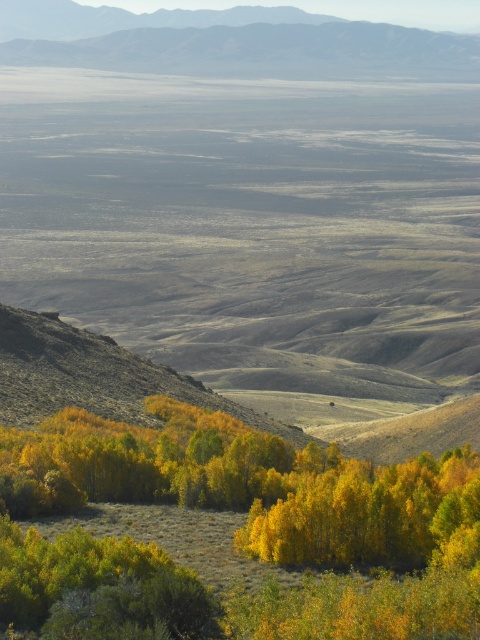
Question: Which object appears closest to the camera in this image?

Choices:
 (A) rugged brown mountain at upper center
 (B) yellow leafy trees at lower left

Answer: (B)

Question: Is yellow leafy trees at lower left positioned in front of rugged brown mountain at upper center?

Choices:
 (A) no
 (B) yes

Answer: (B)

Question: Which point is farther from the camera taking this photo?

Choices:
 (A) (324, 540)
 (B) (40, 10)

Answer: (B)

Question: Can you confirm if yellow leafy trees at lower left is wider than rugged brown mountain at upper center?

Choices:
 (A) no
 (B) yes

Answer: (A)

Question: Which point is closer to the camera taking this photo?

Choices:
 (A) (479, 531)
 (B) (86, 58)

Answer: (A)

Question: Is yellow leafy trees at lower left bigger than rugged brown mountain at upper center?

Choices:
 (A) yes
 (B) no

Answer: (B)